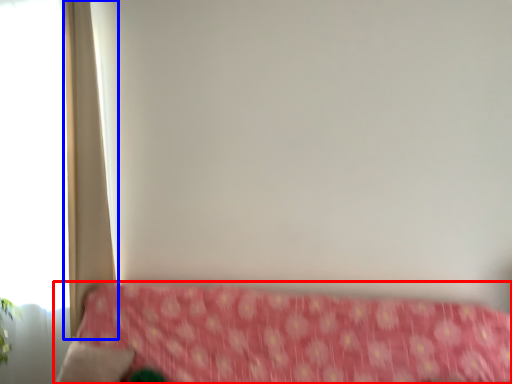
Question: Which point is further to the camera, furniture (highlighted by a red box) or curtain (highlighted by a blue box)?

Choices:
 (A) furniture
 (B) curtain

Answer: (B)